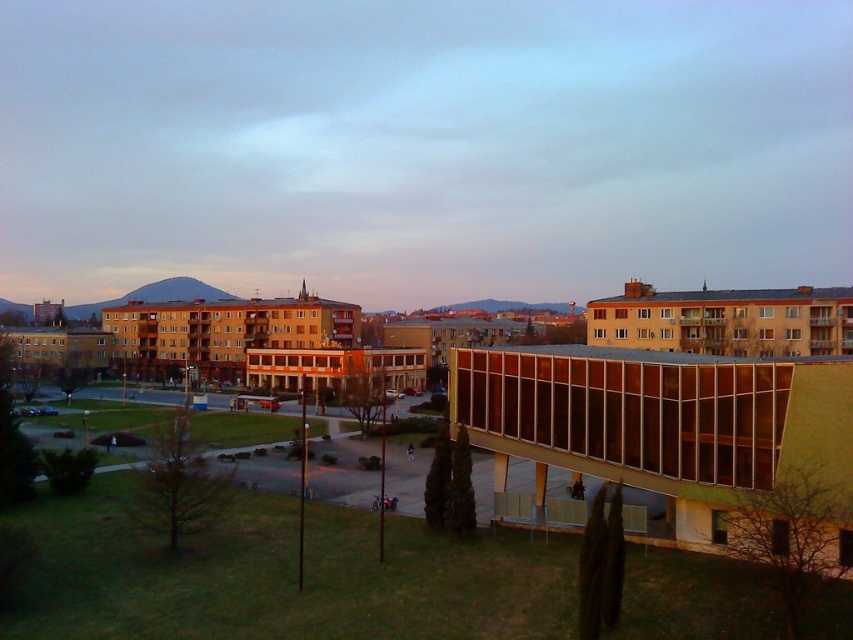
Question: Is the position of matte orange building at center less distant than that of translucent glass building at center?

Choices:
 (A) no
 (B) yes

Answer: (A)

Question: Which point appears closest to the camera in this image?

Choices:
 (A) (352, 77)
 (B) (624, 369)

Answer: (B)

Question: Can you confirm if matte orange building at center is thinner than translucent glass building at center?

Choices:
 (A) yes
 (B) no

Answer: (B)

Question: Is matte orange building at center to the right of translucent glass building at center from the viewer's perspective?

Choices:
 (A) no
 (B) yes

Answer: (A)